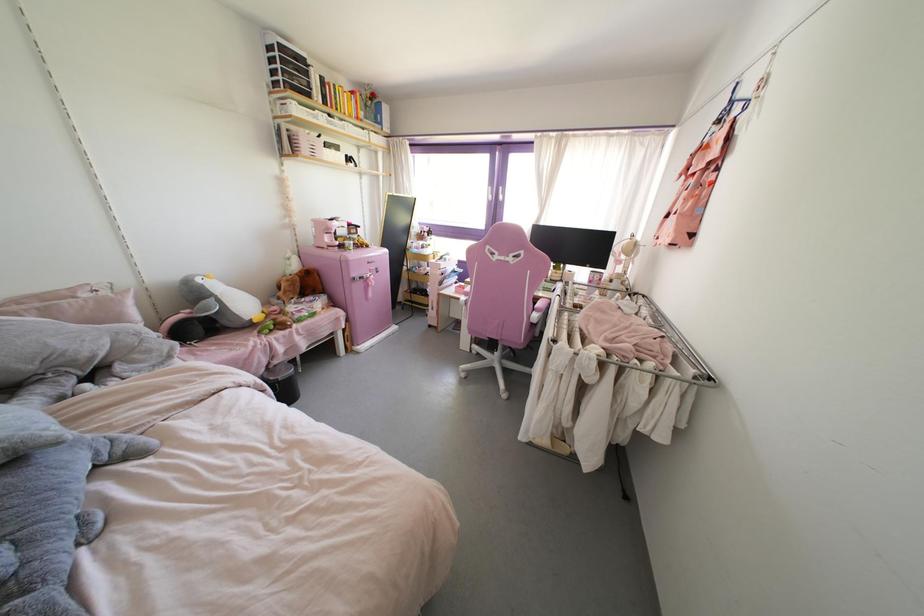
Locate an element on the screen. pink chair armrest is located at coordinates (539, 310).